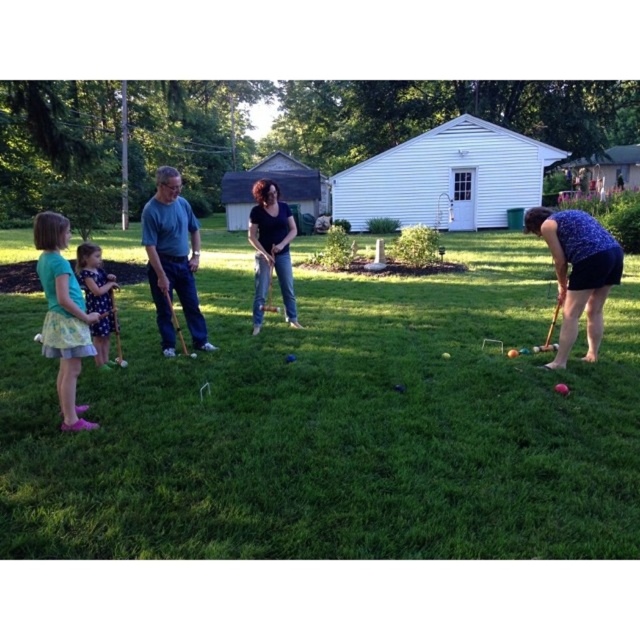
You are a photographer trying to capture a photo of the two adults in the croquet game. You notice the blue cotton shirt at left and dark blue shirt at center. Which adult is taller?

The blue cotton shirt at left is taller than the dark blue shirt at center, so the adult wearing the blue cotton shirt at left is taller.

You are standing in the croquet lawn and want to place a flag at the point closer to you between the two points marked as point 1 at point (x=186, y=320) and point 2 at point (x=289, y=236). Which point should you choose?

You should choose point 1 at point (x=186, y=320) because it is closer to the viewer than point 2 at point (x=289, y=236).

You are planning to buy a new outfit that matches the style of the green floral dress at left and dark blue shirt at center. If you want to choose an outfit with a wider silhouette, which one should you pick?

The green floral dress at left has a larger width than the dark blue shirt at center, so you should pick the green floral dress at left for a wider silhouette.